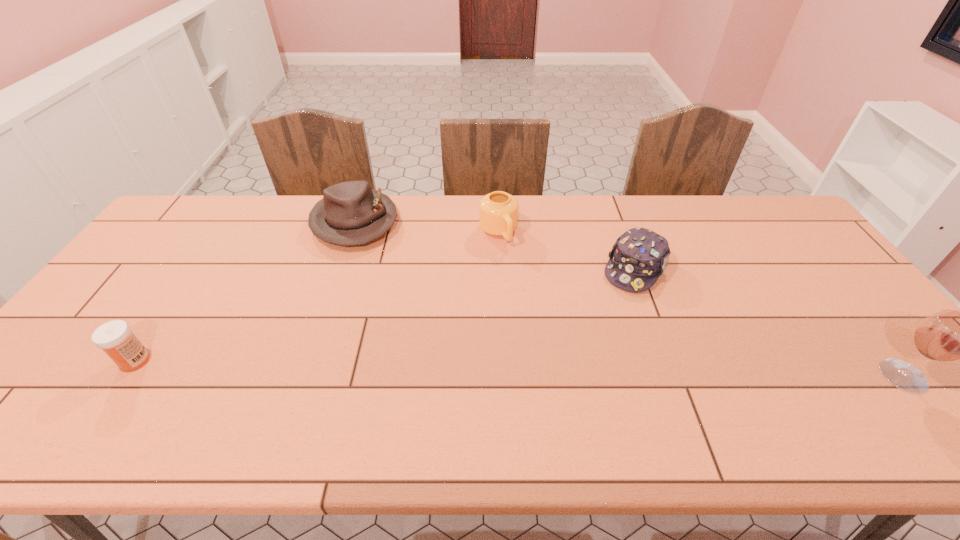
Locate an element on the screen. This screenshot has width=960, height=540. wineglass located in the near edge section of the desktop is located at coordinates (948, 335).

The width and height of the screenshot is (960, 540). I want to click on object positioned at the right edge, so click(x=948, y=335).

This screenshot has width=960, height=540. I want to click on object situated at the near right corner, so click(948, 335).

Locate an element on the screen. free location at the far edge of the desktop is located at coordinates (643, 202).

This screenshot has height=540, width=960. In the image, there is a desktop. In order to click on vacant space at the near edge in this screenshot , I will do tap(478, 396).

This screenshot has width=960, height=540. In the image, there is a desktop. What are the coordinates of `vacant space at the far left corner` in the screenshot? It's located at (197, 206).

In the image, there is a desktop. Where is `vacant space at the near left corner`? This screenshot has width=960, height=540. vacant space at the near left corner is located at coordinates (77, 393).

The height and width of the screenshot is (540, 960). I want to click on free region at the far right corner of the desktop, so coord(745,224).

Locate an element on the screen. empty space between the mug and the leftmost object is located at coordinates (317, 296).

The image size is (960, 540). Identify the location of empty space that is in between the rightmost object and the leftmost object. (519, 368).